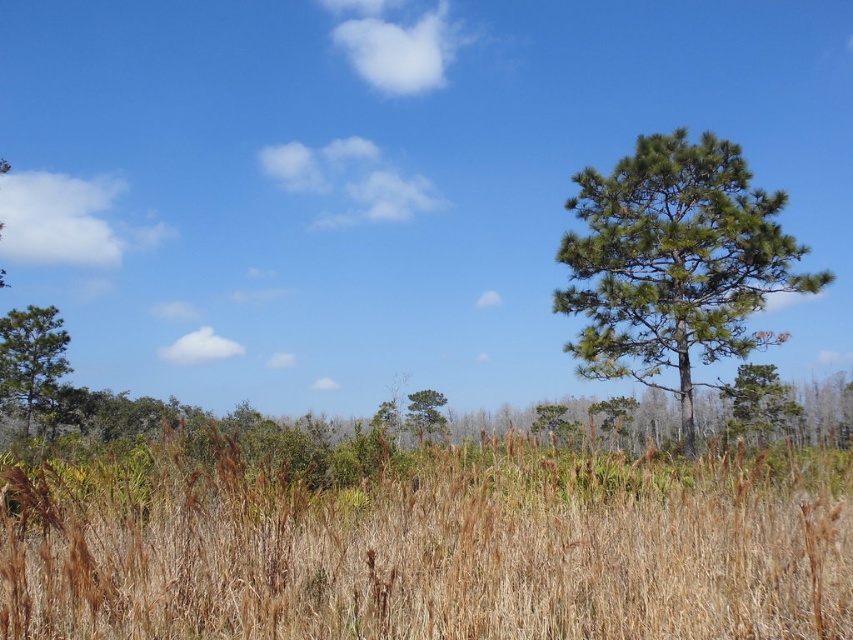
Can you confirm if green needle-like tree at right is smaller than green needle-like tree at center-right?

Yes, green needle-like tree at right is smaller than green needle-like tree at center-right.

Is the position of green needle-like tree at right more distant than that of green needle-like tree at center-right?

No, green needle-like tree at right is closer to the viewer.

The height and width of the screenshot is (640, 853). Identify the location of green needle-like tree at right. (674, 262).

Who is shorter, green textured pine tree at left or green matte tree at center?

green matte tree at center

Who is more forward, (67, 372) or (436, 432)?

Point (67, 372) is more forward.

Find the location of `green textured pine tree at left`. green textured pine tree at left is located at coordinates (30, 358).

How distant is green needle-like tree at right from green matte tree at center?

green needle-like tree at right is 37.91 meters away from green matte tree at center.

At what (x,y) coordinates should I click in order to perform the action: click on green needle-like tree at right. Please return your answer as a coordinate pair (x, y). Looking at the image, I should click on (674, 262).

The image size is (853, 640). In order to click on green needle-like tree at right in this screenshot , I will do `click(674, 262)`.